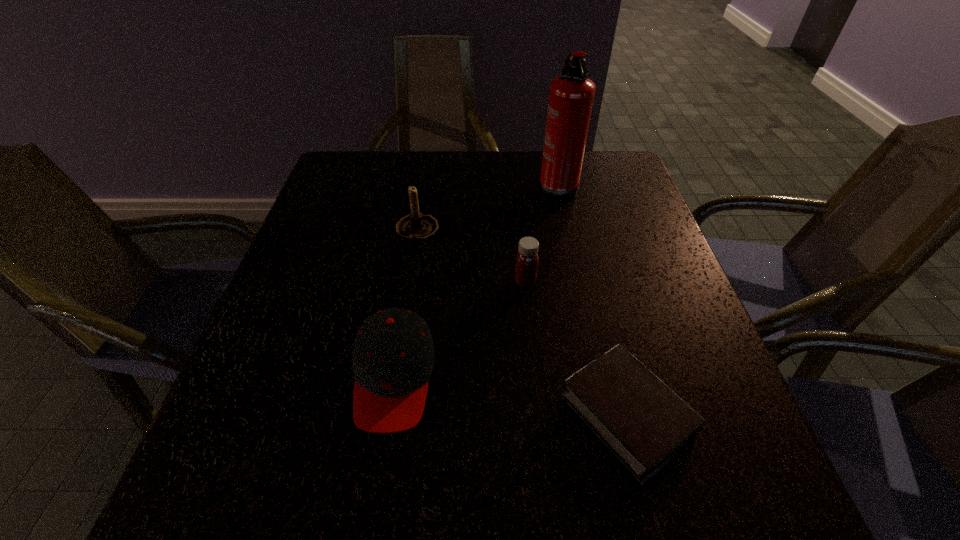
Identify the location of vacant point located 0.170m at the nozzle of the fire extinguisher. (474, 186).

At what (x,y) coordinates should I click in order to perform the action: click on free region located on the front of the fourth nearest object. Please return your answer as a coordinate pair (x, y). This screenshot has width=960, height=540. Looking at the image, I should click on (394, 380).

Find the location of a particular element. The image size is (960, 540). vacant area situated 0.290m on the right of the third object from left to right is located at coordinates (672, 281).

The image size is (960, 540). In order to click on free point located 0.100m on the front-facing side of the cap in this screenshot , I will do `click(373, 504)`.

Locate an element on the screen. The image size is (960, 540). free space located on the back of the Bible is located at coordinates (599, 304).

The image size is (960, 540). I want to click on object that is at the far edge, so click(571, 97).

Where is `object that is at the near edge`? Image resolution: width=960 pixels, height=540 pixels. object that is at the near edge is located at coordinates (644, 423).

You are a GUI agent. You are given a task and a screenshot of the screen. Output one action in this format:
    pyautogui.click(x=<x>, y=<y>)
    Task: Click on the fire extinguisher that is at the right edge
    This screenshot has height=540, width=960.
    Given the screenshot: What is the action you would take?
    pyautogui.click(x=571, y=97)

I want to click on Bible situated at the right edge, so click(644, 423).

Locate an element on the screen. The height and width of the screenshot is (540, 960). object positioned at the far right corner is located at coordinates (571, 97).